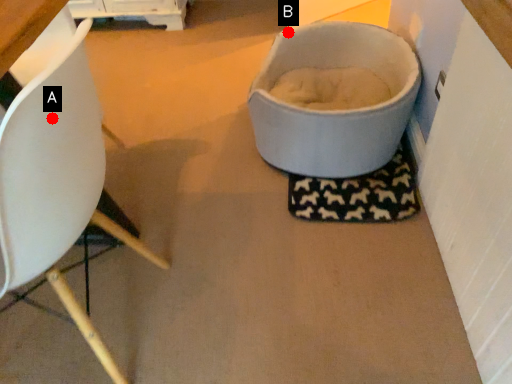
Question: Two points are circled on the image, labeled by A and B beside each circle. Which point is closer to the camera?

Choices:
 (A) A is closer
 (B) B is closer

Answer: (A)